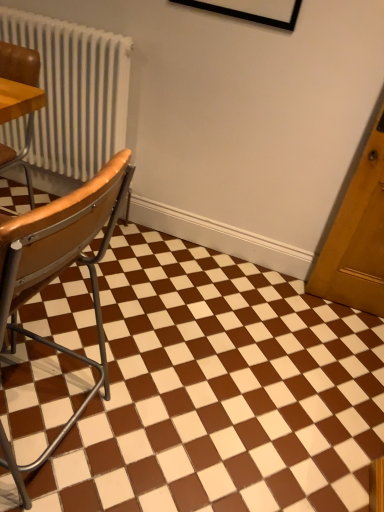
Question: Does leather seat at left, which is the first chair in top-to-bottom order, touch brown glossy tile at center?

Choices:
 (A) yes
 (B) no

Answer: (B)

Question: Is leather seat at left, which is the first chair in top-to-bottom order, thinner than brown glossy tile at center?

Choices:
 (A) no
 (B) yes

Answer: (B)

Question: From the image's perspective, is leather seat at left, which appears as the 2th chair when ordered from the bottom, located above brown glossy tile at center?

Choices:
 (A) no
 (B) yes

Answer: (B)

Question: Are leather seat at left, which appears as the 2th chair when ordered from the bottom, and brown glossy tile at center located far from each other?

Choices:
 (A) no
 (B) yes

Answer: (B)

Question: Is leather seat at left, which appears as the 2th chair when ordered from the bottom, in front of brown glossy tile at center?

Choices:
 (A) no
 (B) yes

Answer: (A)

Question: From a real-world perspective, is leather seat at left, which appears as the 2th chair when ordered from the bottom, positioned above or below wooden seat at left, marked as the 2th chair in a top-to-bottom arrangement?

Choices:
 (A) below
 (B) above

Answer: (B)

Question: Considering the positions of leather seat at left, which appears as the 2th chair when ordered from the bottom, and wooden seat at left, marked as the 2th chair in a top-to-bottom arrangement, in the image, is leather seat at left, which appears as the 2th chair when ordered from the bottom, bigger or smaller than wooden seat at left, marked as the 2th chair in a top-to-bottom arrangement,?

Choices:
 (A) small
 (B) big

Answer: (A)

Question: From their relative heights in the image, would you say leather seat at left, which is the first chair in top-to-bottom order, is taller or shorter than wooden seat at left, marked as the 2th chair in a top-to-bottom arrangement?

Choices:
 (A) short
 (B) tall

Answer: (A)

Question: Is point (6, 152) positioned closer to the camera than point (119, 173)?

Choices:
 (A) closer
 (B) farther

Answer: (B)

Question: Is brown glossy tile at center wider or thinner than leather seat at left, which appears as the 2th chair when ordered from the bottom?

Choices:
 (A) wide
 (B) thin

Answer: (A)

Question: Does point (249, 460) appear closer or farther from the camera than point (26, 172)?

Choices:
 (A) farther
 (B) closer

Answer: (B)

Question: Looking at the image, does brown glossy tile at center seem bigger or smaller compared to leather seat at left, which is the first chair in top-to-bottom order?

Choices:
 (A) big
 (B) small

Answer: (A)

Question: Relative to leather seat at left, which appears as the 2th chair when ordered from the bottom, is brown glossy tile at center in front or behind?

Choices:
 (A) behind
 (B) front

Answer: (B)

Question: Is point (31, 58) positioned closer to the camera than point (155, 488)?

Choices:
 (A) farther
 (B) closer

Answer: (A)

Question: From the image's perspective, is leather seat at left, which is the first chair in top-to-bottom order, located above or below brown glossy tile at center?

Choices:
 (A) below
 (B) above

Answer: (B)